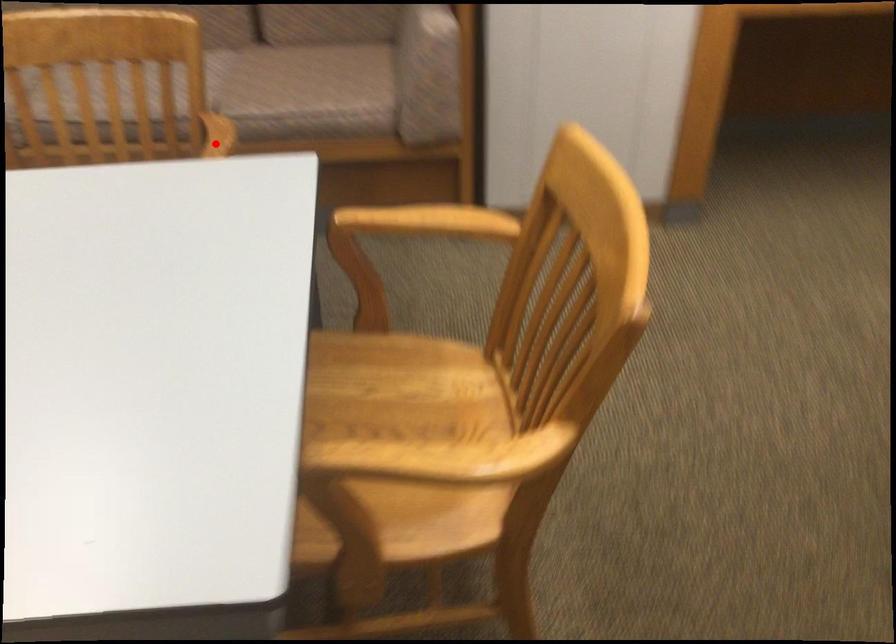
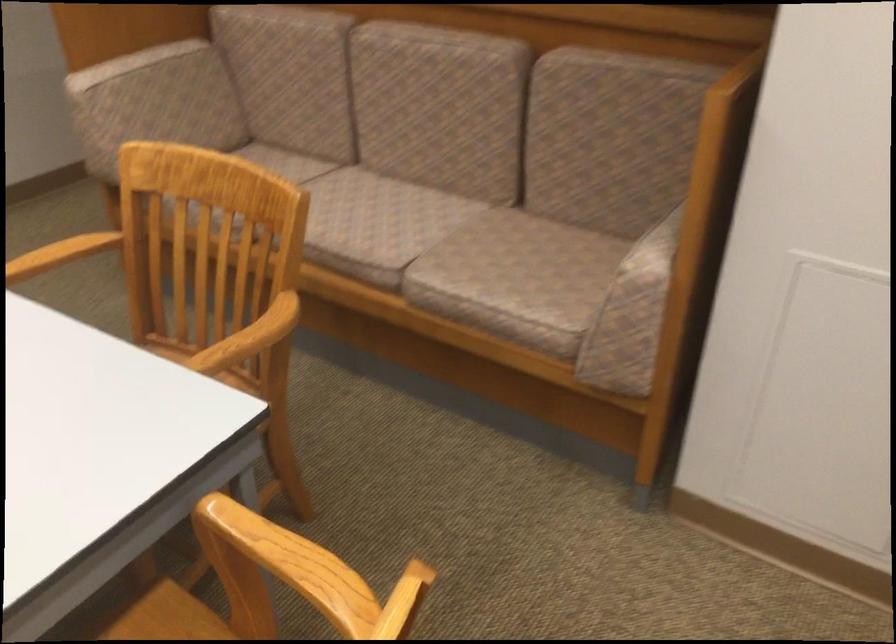
Question: I am providing you with two images of the same scene from different viewpoints. Given a red point in image1, look at the same physical point in image2. Is it:

Choices:
 (A) Closer to the viewpoint
 (B) Farther from the viewpoint

Answer: (A)